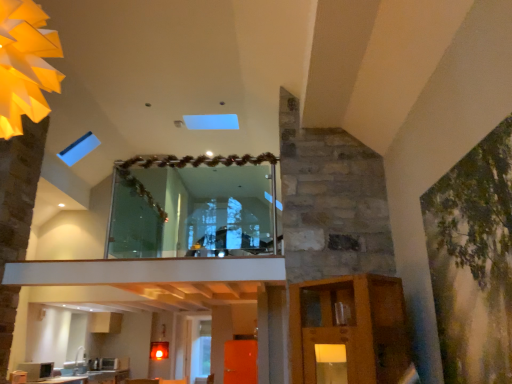
Question: Is green matte painting at right next to transparent glass door at center and touching it?

Choices:
 (A) no
 (B) yes

Answer: (A)

Question: Is green matte painting at right facing towards transparent glass door at center?

Choices:
 (A) no
 (B) yes

Answer: (A)

Question: Is the position of green matte painting at right more distant than that of transparent glass door at center?

Choices:
 (A) no
 (B) yes

Answer: (A)

Question: Considering the relative sizes of green matte painting at right and transparent glass door at center in the image provided, is green matte painting at right shorter than transparent glass door at center?

Choices:
 (A) no
 (B) yes

Answer: (B)

Question: Is green matte painting at right wider than transparent glass door at center?

Choices:
 (A) yes
 (B) no

Answer: (B)

Question: Would you say white glossy countertop at lower left is to the left or to the right of green matte painting at right in the picture?

Choices:
 (A) right
 (B) left

Answer: (B)

Question: Is white glossy countertop at lower left spatially inside green matte painting at right, or outside of it?

Choices:
 (A) outside
 (B) inside

Answer: (A)

Question: From the image's perspective, is white glossy countertop at lower left positioned above or below green matte painting at right?

Choices:
 (A) above
 (B) below

Answer: (B)

Question: From a real-world perspective, relative to green matte painting at right, is white glossy countertop at lower left vertically above or below?

Choices:
 (A) below
 (B) above

Answer: (A)

Question: From a real-world perspective, is matte black microwave at lower left physically located above or below matte yellow paper light at upper left?

Choices:
 (A) below
 (B) above

Answer: (A)

Question: Is matte black microwave at lower left wider or thinner than matte yellow paper light at upper left?

Choices:
 (A) wide
 (B) thin

Answer: (B)

Question: Is point (40, 362) closer or farther from the camera than point (13, 71)?

Choices:
 (A) farther
 (B) closer

Answer: (A)

Question: From the image's perspective, is matte black microwave at lower left positioned above or below matte yellow paper light at upper left?

Choices:
 (A) below
 (B) above

Answer: (A)

Question: Is point (41, 370) closer or farther from the camera than point (480, 167)?

Choices:
 (A) closer
 (B) farther

Answer: (B)

Question: In the image, is matte black microwave at lower left positioned in front of or behind green matte painting at right?

Choices:
 (A) front
 (B) behind

Answer: (B)